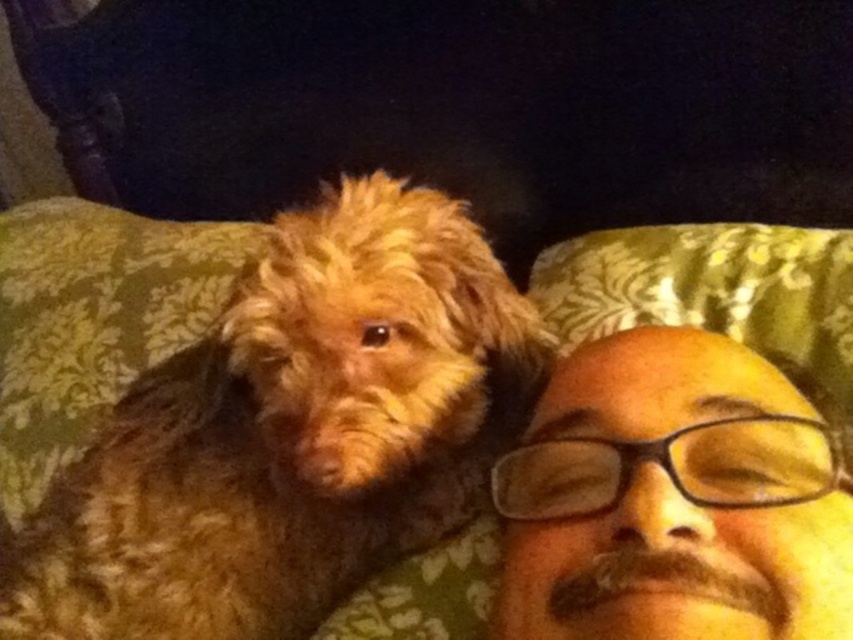
Can you confirm if fuzzy brown dog at upper left is shorter than brown matte face at upper right?

No, fuzzy brown dog at upper left is not shorter than brown matte face at upper right.

Who is more forward, (459, 452) or (564, 449)?

Point (564, 449) is in front.

Which is in front, point (277, 588) or point (776, 465)?

Point (776, 465) is in front.

Image resolution: width=853 pixels, height=640 pixels. Identify the location of fuzzy brown dog at upper left. (291, 433).